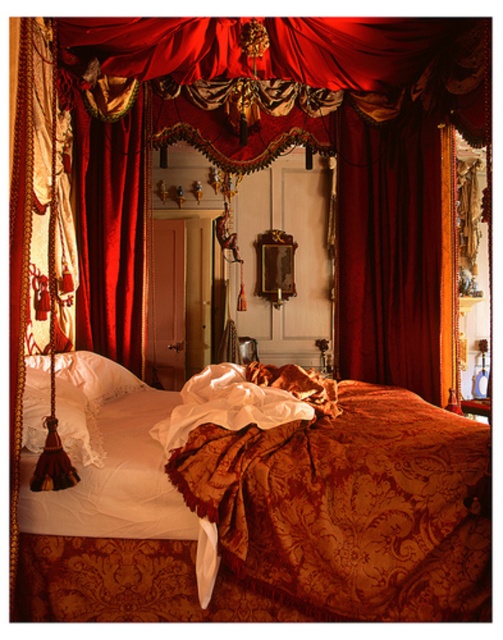
You are an interior designer planning to place a new lamp on the bed. The lamp requires a space at point coordinates between 0.7 and 0.8 on the x and y axes. Is the gold damask blanket at center located within this area?

The gold damask blanket at center is located at point coordinates of [349,500]. Since the x coordinate 0.784 is between 0.7 and 0.8, but the y coordinate 0.694 is below 0.7, it is partially within the required area but not fully within both axes. Therefore, the blanket is not entirely within the specified coordinates range.

You are standing in the bedroom and want to see the velvet drapery at left behind the gold damask blanket at center. What should you do?

You need to move the gold damask blanket at center to see the velvet drapery at left behind it.

You are an interior designer planning to place a large decorative vase between the gold damask blanket at center and the velvet deep red curtain at center. Given their sizes, which object should the vase be closer to?

The gold damask blanket at center has a larger size compared to the velvet deep red curtain at center, so the vase should be placed closer to the smaller velvet deep red curtain at center to balance the composition.